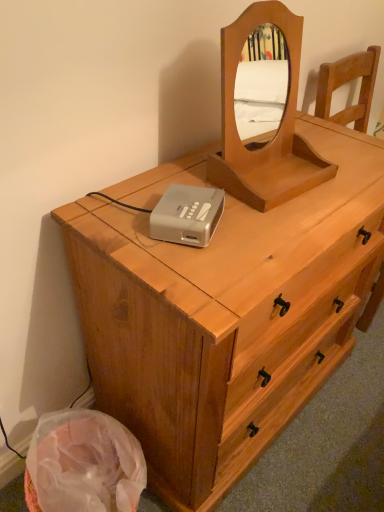
Where is `free region on the left part of light brown wooden mirror at upper center`? The height and width of the screenshot is (512, 384). free region on the left part of light brown wooden mirror at upper center is located at coordinates (170, 170).